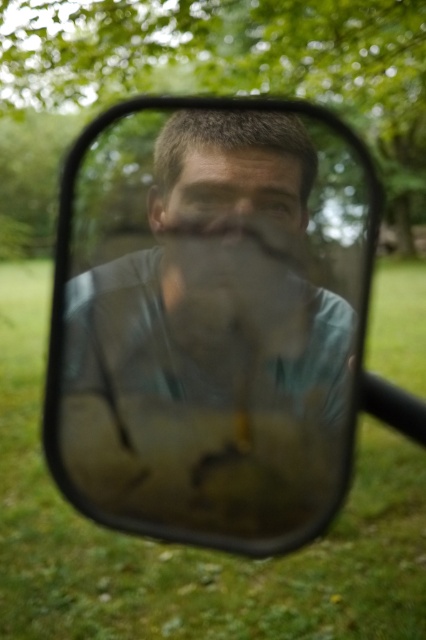
Is green leafy tree at upper center to the right of smooth skin face at center from the viewer's perspective?

Indeed, green leafy tree at upper center is positioned on the right side of smooth skin face at center.

Between point (348, 16) and point (259, 188), which one is positioned behind?

The point (348, 16) is behind.

The width and height of the screenshot is (426, 640). I want to click on green leafy tree at upper center, so click(236, 64).

Based on the photo, can you confirm if clear glass mirror at center is smaller than smooth skin face at center?

Actually, clear glass mirror at center might be larger than smooth skin face at center.

Is point (80, 412) positioned behind point (268, 189)?

That is False.

Where is `clear glass mirror at center`? This screenshot has width=426, height=640. clear glass mirror at center is located at coordinates (210, 320).

From the picture: Who is higher up, clear glass mirror at center or green leafy tree at upper center?

green leafy tree at upper center

Does clear glass mirror at center appear on the left side of green leafy tree at upper center?

Indeed, clear glass mirror at center is positioned on the left side of green leafy tree at upper center.

Find the location of a particular element. The width and height of the screenshot is (426, 640). clear glass mirror at center is located at coordinates (210, 320).